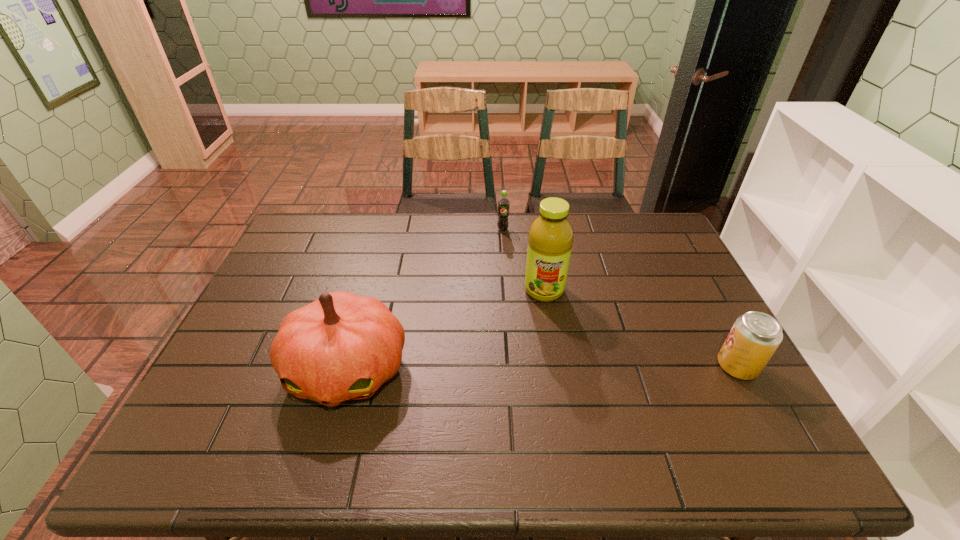
Identify the location of the third shortest object. coord(341,347).

Locate an element on the screen. pumpkin is located at coordinates (341, 347).

Locate an element on the screen. The width and height of the screenshot is (960, 540). the right soda is located at coordinates (755, 336).

Where is `the rightmost object`? Image resolution: width=960 pixels, height=540 pixels. the rightmost object is located at coordinates (755, 336).

What are the coordinates of `the third object from left to right` in the screenshot? It's located at (550, 238).

The width and height of the screenshot is (960, 540). I want to click on fruit juice, so click(550, 238).

The image size is (960, 540). What are the coordinates of `the farthest object` in the screenshot? It's located at (503, 203).

Locate an element on the screen. the farther soda is located at coordinates coord(503,203).

This screenshot has width=960, height=540. Find the location of `vacant space located on the left of the rightmost object`. vacant space located on the left of the rightmost object is located at coordinates (690, 366).

What are the coordinates of `vacant space located on the front label of the second farthest object` in the screenshot? It's located at (540, 392).